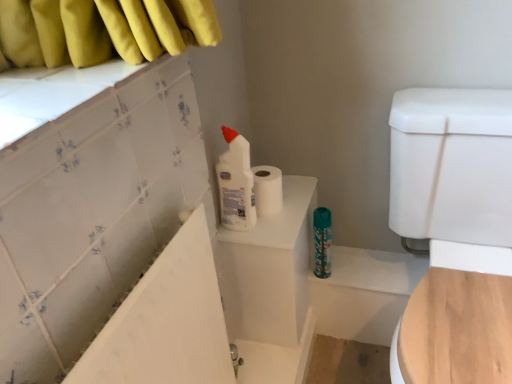
The height and width of the screenshot is (384, 512). I want to click on free spot in front of white matte toilet paper at upper center, so click(x=276, y=230).